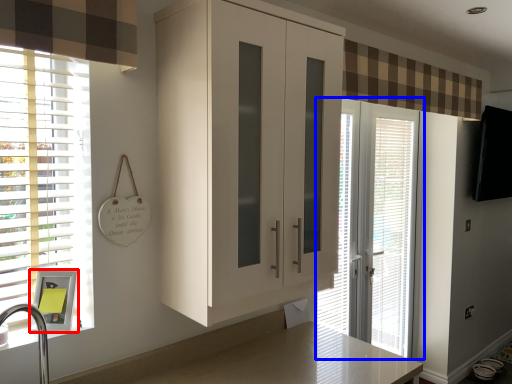
Question: Which object is closer to the camera taking this photo, medicine cabinet (highlighted by a red box) or door (highlighted by a blue box)?

Choices:
 (A) medicine cabinet
 (B) door

Answer: (A)